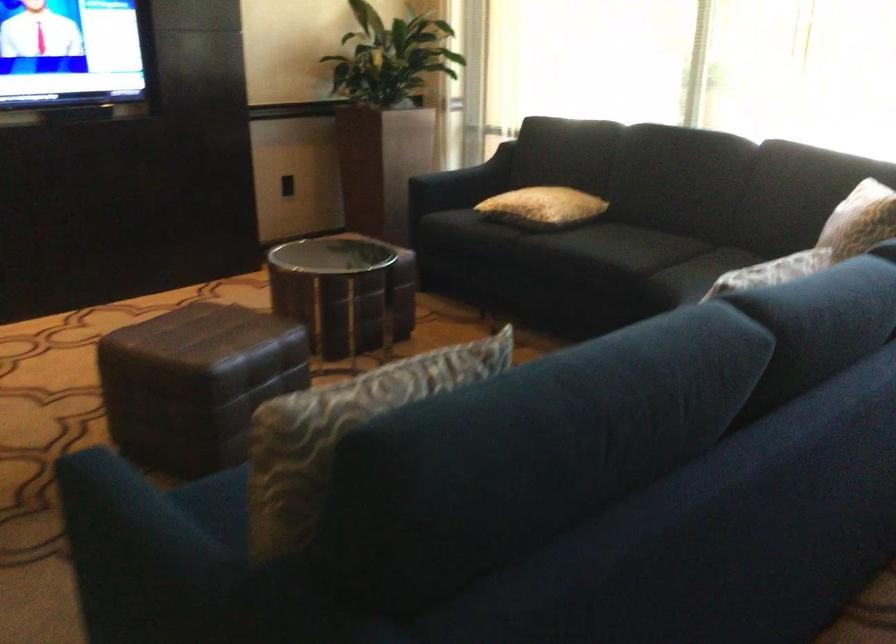
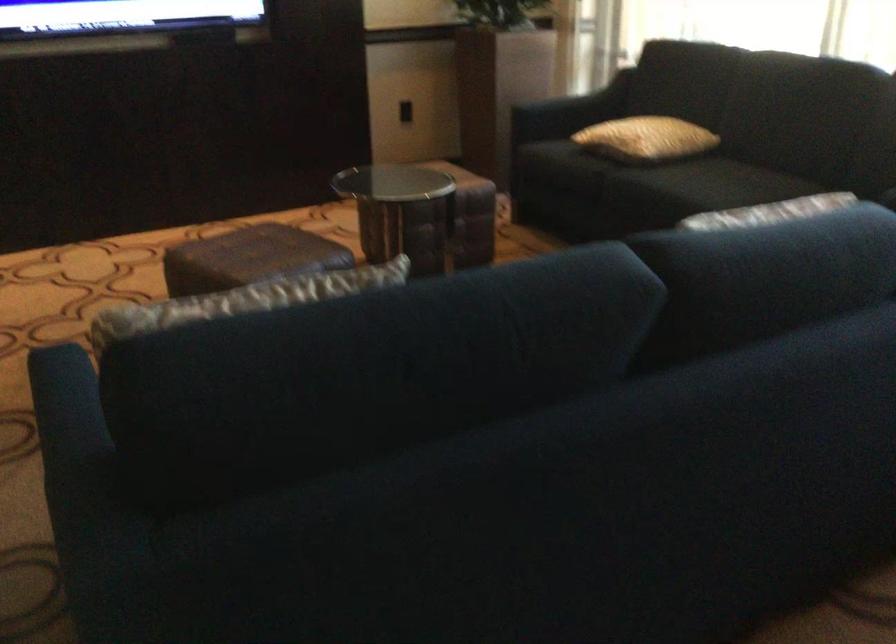
Question: The camera is either moving clockwise (left) or counter-clockwise (right) around the object. The first image is from the beginning of the video and the second image is from the end. Is the camera moving left or right when shooting the video?

Choices:
 (A) Left
 (B) Right

Answer: (B)